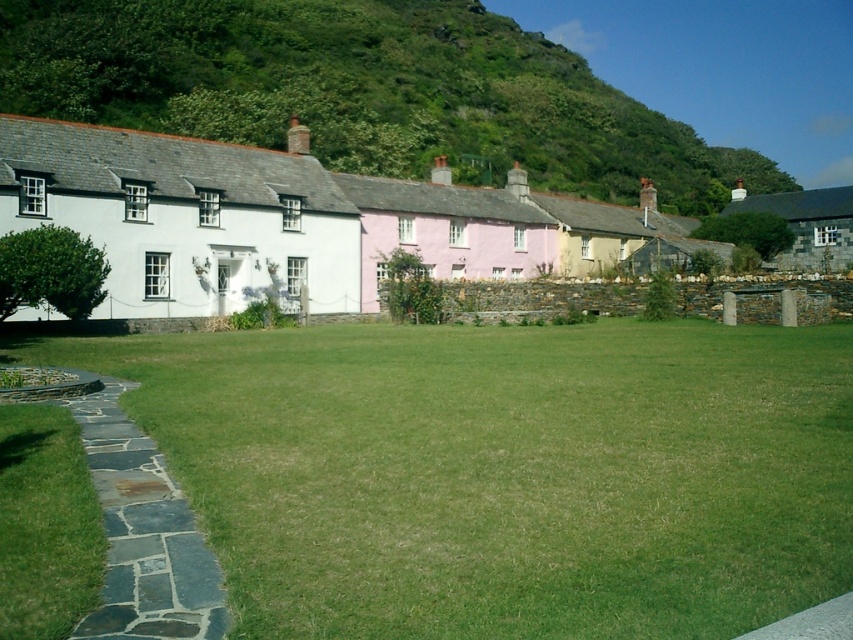
Question: Which object is the farthest from the white matte cottage at left?

Choices:
 (A) stone cottage at right
 (B) dark gray stone path at lower left

Answer: (A)

Question: Can you confirm if green leafy hillside at upper center is bigger than pink matte cottage at center?

Choices:
 (A) yes
 (B) no

Answer: (A)

Question: In this image, where is white matte cottage at left located relative to pink matte cottage at center?

Choices:
 (A) right
 (B) left

Answer: (B)

Question: Can you confirm if green grass at center is positioned to the right of pink matte cottage at center?

Choices:
 (A) yes
 (B) no

Answer: (A)

Question: Which point is closer to the camera?

Choices:
 (A) (722, 216)
 (B) (155, 572)

Answer: (B)

Question: Based on their relative distances, which object is nearer to the green leafy hillside at upper center?

Choices:
 (A) stone cottage at right
 (B) white matte cottage at left

Answer: (A)